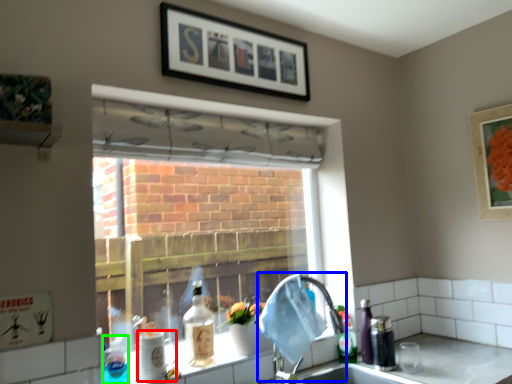
Question: Estimate the real-world distances between objects in this image. Which object is farther from beverage (highlighted by a red box), faucet (highlighted by a blue box) or bottle (highlighted by a green box)?

Choices:
 (A) faucet
 (B) bottle

Answer: (A)